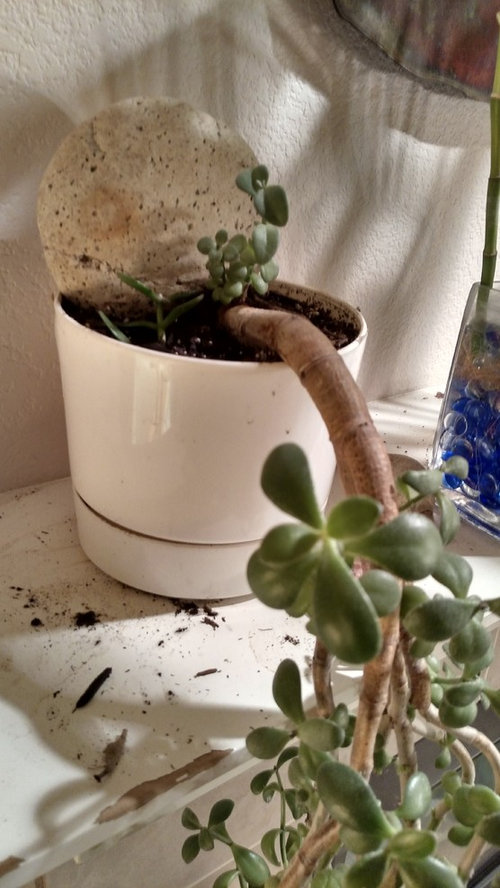
Find the location of `white wall`. white wall is located at coordinates (332, 153).